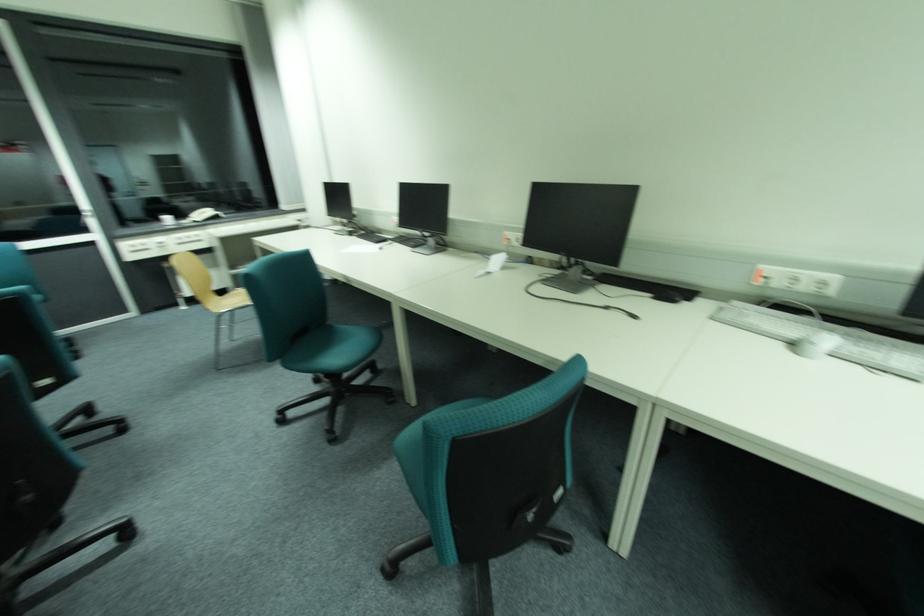
What do you see at coordinates (554, 539) in the screenshot? I see `a black chair lever` at bounding box center [554, 539].